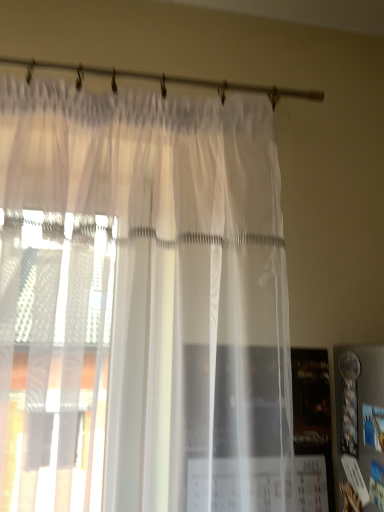
What do you see at coordinates (162, 80) in the screenshot?
I see `transparent fabric at upper center` at bounding box center [162, 80].

Identify the location of transparent fabric at upper center. (162, 80).

Locate an element on the screen. This screenshot has height=512, width=384. transparent fabric at upper center is located at coordinates (162, 80).